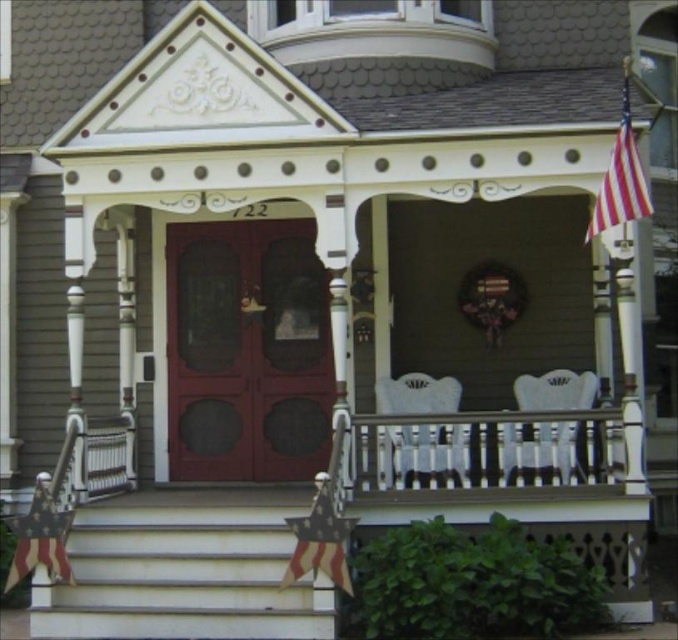
Question: Which object is closer to the camera taking this photo?

Choices:
 (A) matte wood door at center
 (B) american flag at lower left
 (C) white painted wood at center
 (D) polyester flag at lower center

Answer: (D)

Question: Which of the following is the closest to the observer?

Choices:
 (A) white painted wood stairs at lower center
 (B) red striped fabric flag at upper right
 (C) polyester flag at lower center

Answer: (C)

Question: Observing the image, what is the correct spatial positioning of polyester flag at lower center in reference to american flag at lower left?

Choices:
 (A) left
 (B) right

Answer: (B)

Question: Is white painted wood stairs at lower center closer to camera compared to polyester flag at lower center?

Choices:
 (A) yes
 (B) no

Answer: (B)

Question: Can you confirm if white painted wood stairs at lower center is wider than white painted wood at center?

Choices:
 (A) no
 (B) yes

Answer: (B)

Question: Which of these objects is positioned farthest from the american flag at lower left?

Choices:
 (A) red striped fabric flag at upper right
 (B) matte wood door at center

Answer: (A)